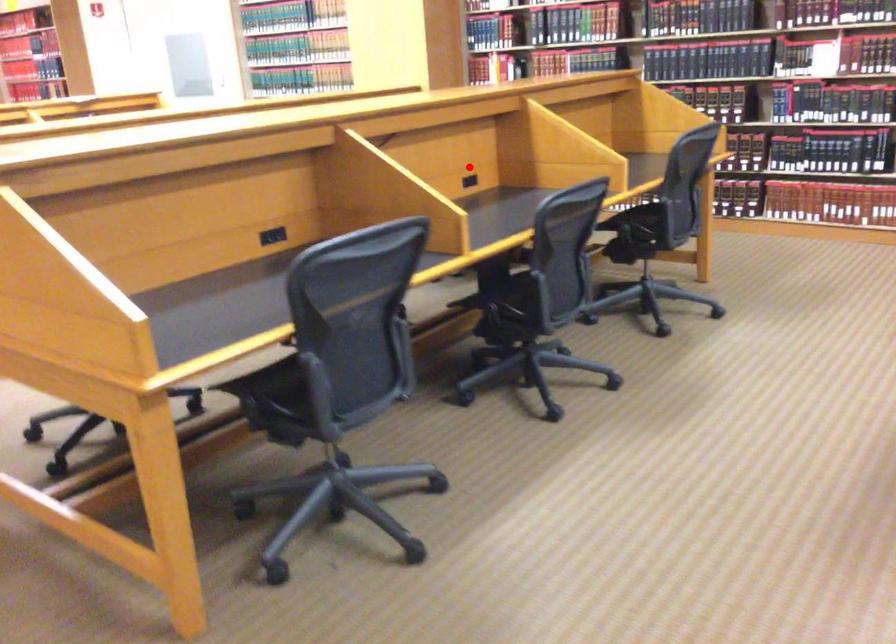
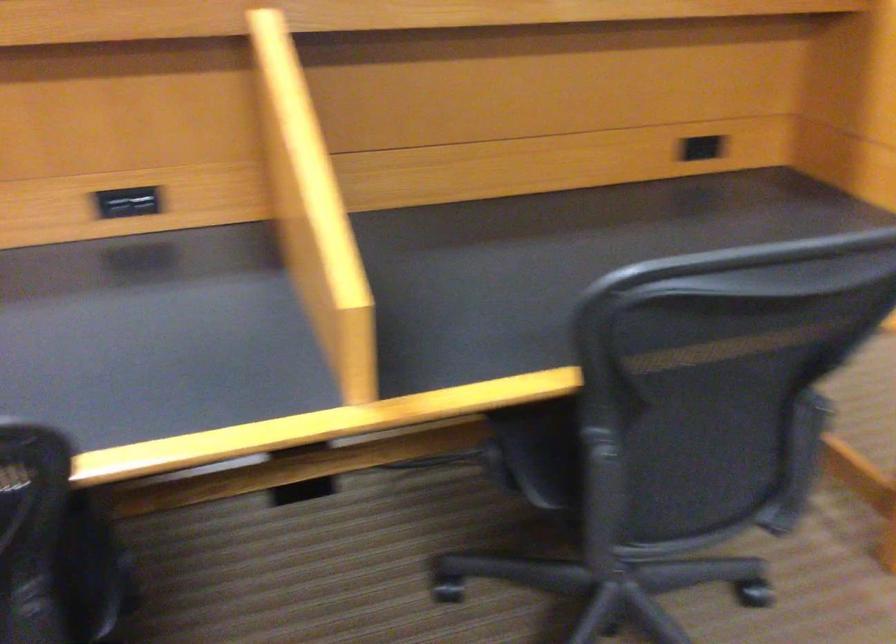
Where in the second image is the point corresponding to the highlighted location from the first image?

(123, 205)